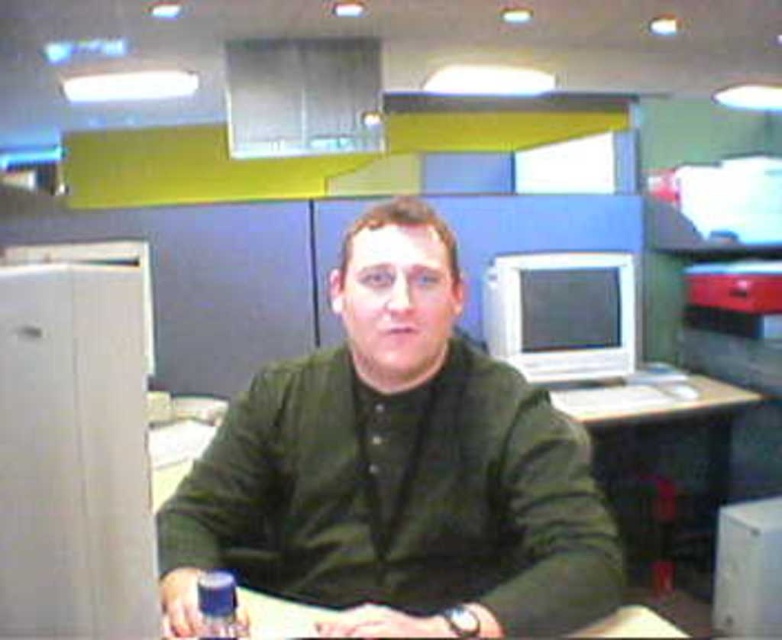
You are an office worker who needs to reach the blue plastic bottle at lower center from your current position near the dark green shirt at center. Can you comfortably reach it without moving your chair?

The dark green shirt at center is 11.33 inches away from the blue plastic bottle at lower center. Since this distance is within typical arm reach, you can comfortably reach the blue plastic bottle at lower center without moving your chair.